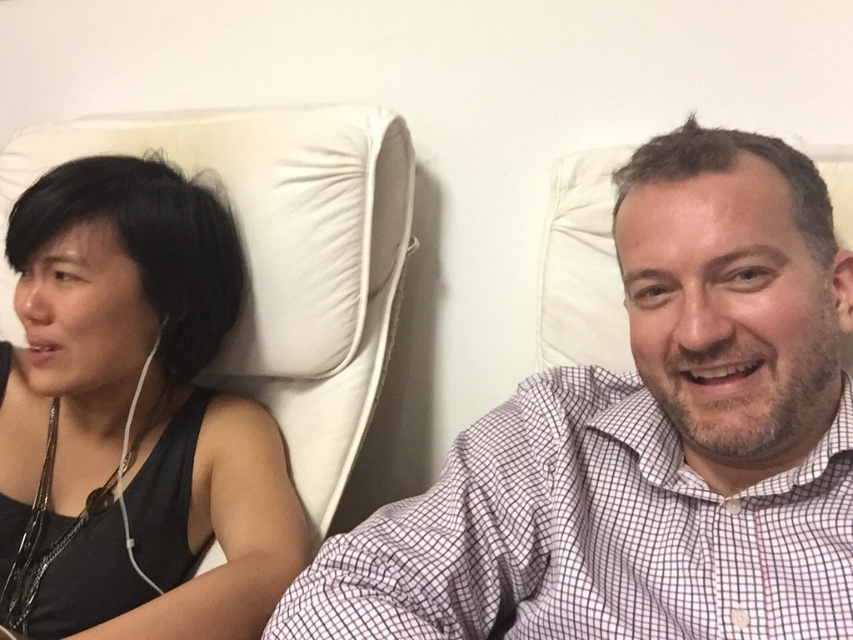
Which is below, white checkered shirt at center or black fabric tank top at left?

Positioned lower is white checkered shirt at center.

Is point (378, 528) farther from camera compared to point (90, 170)?

No, (378, 528) is closer to viewer.

This screenshot has width=853, height=640. I want to click on white checkered shirt at center, so click(645, 442).